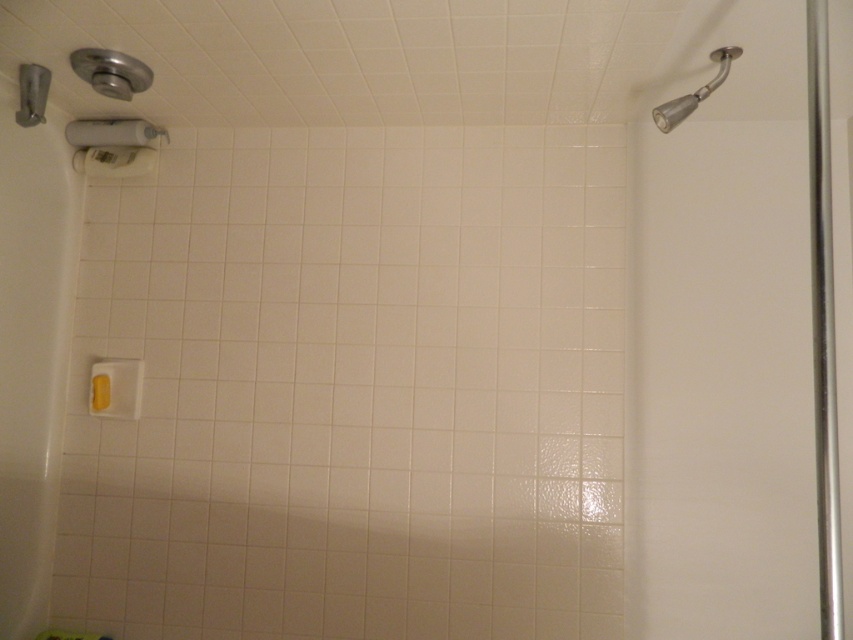
Which is in front, point (704, 628) or point (32, 64)?

Point (32, 64) is in front.

Does silver metallic shower door at right have a larger size compared to matte gray showerhead at upper left?

Yes.

Identify the location of silver metallic shower door at right. (722, 342).

Looking at this image, is silver metallic shower door at right closer to camera compared to satin nickel showerhead at upper right?

That is True.

Who is higher up, silver metallic shower door at right or satin nickel showerhead at upper right?

satin nickel showerhead at upper right

In order to click on silver metallic shower door at right in this screenshot , I will do `click(722, 342)`.

Which of these two, satin nickel showerhead at upper right or matte gray showerhead at upper left, stands taller?

Standing taller between the two is satin nickel showerhead at upper right.

Is satin nickel showerhead at upper right above matte gray showerhead at upper left?

No.

The image size is (853, 640). I want to click on satin nickel showerhead at upper right, so click(694, 92).

Where is `satin nickel showerhead at upper right`? satin nickel showerhead at upper right is located at coordinates (694, 92).